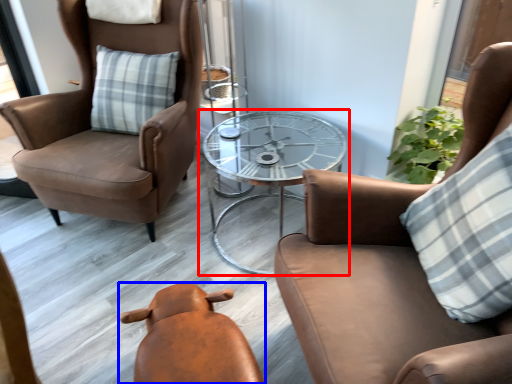
Question: Which object appears farthest to the camera in this image, table (highlighted by a red box) or chair (highlighted by a blue box)?

Choices:
 (A) table
 (B) chair

Answer: (A)